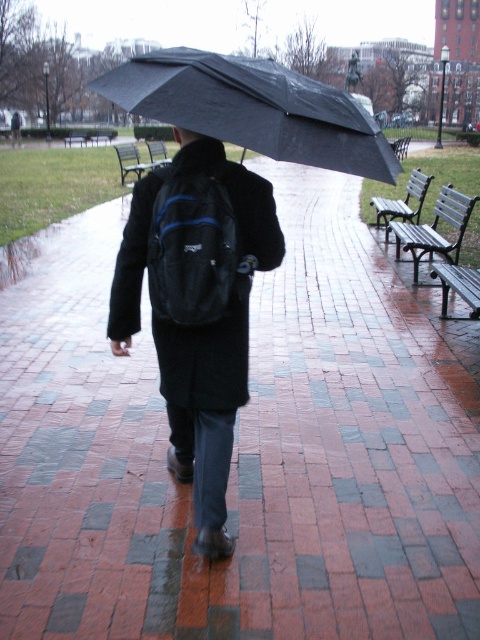
You are a photographer trying to capture the person walking on the wet brick pathway. You want to ensure both the black matte umbrella at center and the black matte backpack at center are clearly visible in your shot. Given their sizes, which object might require you to adjust your camera angle to avoid it blocking the other?

The black matte umbrella at center has a larger width than the black matte backpack at center, so it might block the backpack if not adjusted properly. You should adjust your camera angle to ensure the umbrella doesn not cover the backpack.